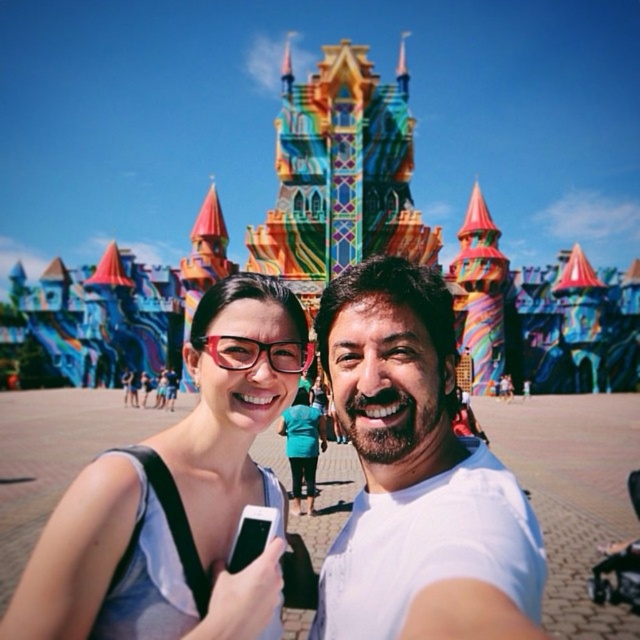
Question: Based on their relative distances, which object is nearer to the matte black glasses at center?

Choices:
 (A) white matte shirt at center
 (B) matte white tank top at center
 (C) translucent pink goggles at center

Answer: (B)

Question: Can you confirm if white matte shirt at center is smaller than matte white tank top at center?

Choices:
 (A) no
 (B) yes

Answer: (B)

Question: Which point is farther to the camera?

Choices:
 (A) (198, 346)
 (B) (144, 385)
 (C) (272, 632)

Answer: (B)

Question: Does white matte shirt at center lie behind matte black glasses at center?

Choices:
 (A) no
 (B) yes

Answer: (A)

Question: Is translucent pink goggles at center to the left of matte black glasses at center from the viewer's perspective?

Choices:
 (A) yes
 (B) no

Answer: (B)

Question: Which of the following is the farthest from the observer?

Choices:
 (A) (360, 330)
 (B) (129, 390)
 (C) (211, 474)

Answer: (B)